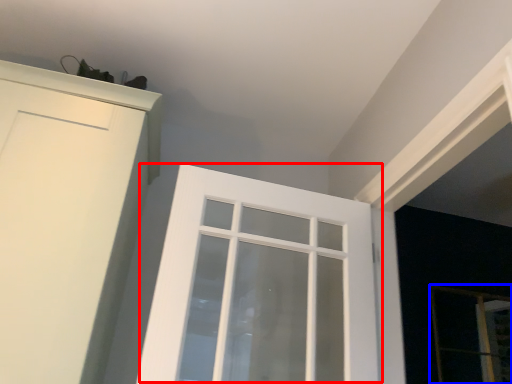
Question: Among these objects, which one is nearest to the camera, window (highlighted by a red box) or screen door (highlighted by a blue box)?

Choices:
 (A) window
 (B) screen door

Answer: (A)